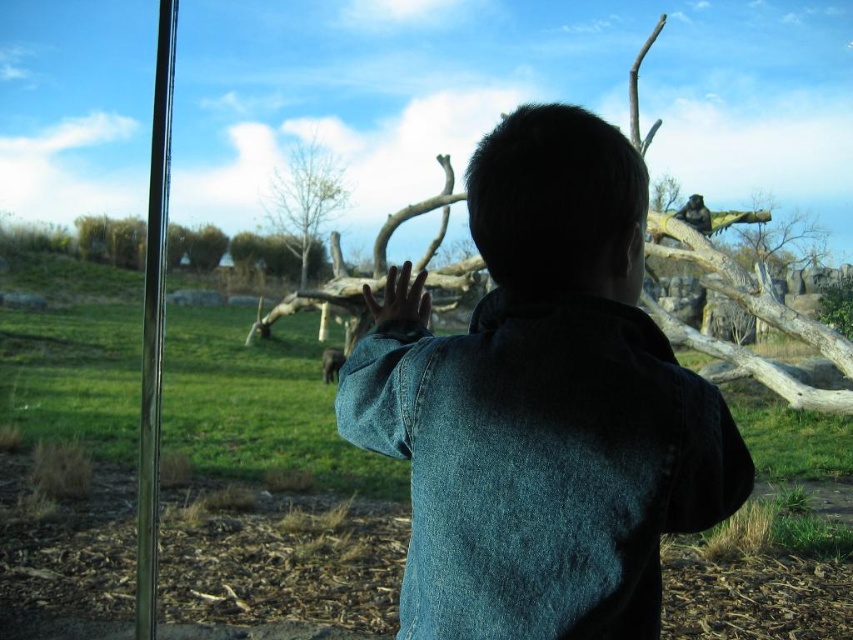
You are a zookeeper planning to install a new sign between the denim jacket at center and the bare wood tree at upper center. Given their sizes, which object should the sign be closer to to ensure visibility?

The sign should be closer to the bare wood tree at upper center because the denim jacket at center is smaller in size, making the tree a better reference point for visibility.

You are a zookeeper planning to install a new feeding station between the two points labeled as point (x=746, y=246) and point (x=679, y=216). Since the feeding station needs to be placed in front of the glass barrier where the child is touching, which point should the feeding station be closer to?

The feeding station should be closer to point (x=679, y=216) because point (x=746, y=246) is behind it, and the station needs to be in front of the glass barrier where the child is.

You are a zoo visitor standing at the entrance of the enclosure. You notice the denim jacket at center and the bare wood tree at upper center. Which object is nearer to you?

The denim jacket at center is closer to the viewer than the bare wood tree at upper center.